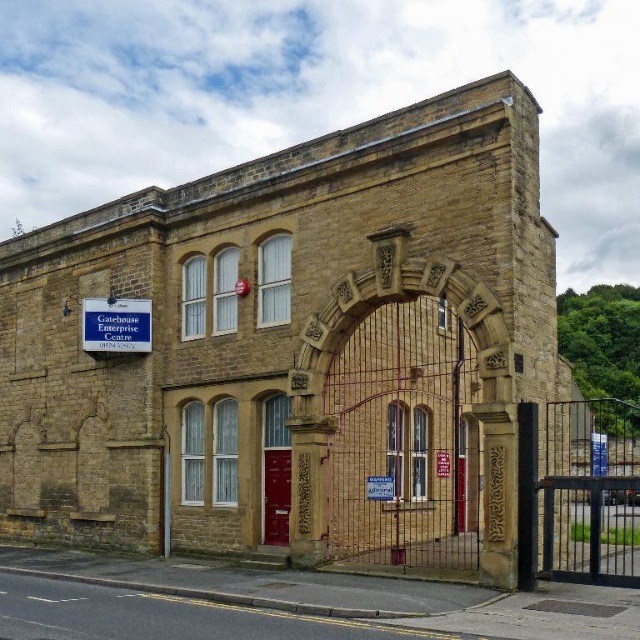
Is white plastic sign at center wider than red plastic sign at center?

Yes, white plastic sign at center is wider than red plastic sign at center.

How much distance is there between white plastic sign at center and red plastic sign at center?

The distance of white plastic sign at center from red plastic sign at center is 6.70 meters.

What are the coordinates of `white plastic sign at center` in the screenshot? It's located at (380, 486).

The width and height of the screenshot is (640, 640). What are the coordinates of `white plastic sign at center` in the screenshot? It's located at (380, 486).

Can you confirm if blue plastic sign at upper left is thinner than red plastic sign at center?

Incorrect, blue plastic sign at upper left's width is not less than red plastic sign at center's.

Between point (124, 298) and point (444, 460), which one is positioned behind?

Point (444, 460)

Is point (97, 332) positioned behind point (442, 456)?

No.

Identify the location of blue plastic sign at upper left. Image resolution: width=640 pixels, height=640 pixels. (x=115, y=324).

Who is taller, blue plastic sign at upper left or white plastic sign at center?

Standing taller between the two is blue plastic sign at upper left.

Which of these two, blue plastic sign at upper left or white plastic sign at center, stands shorter?

With less height is white plastic sign at center.

Between point (84, 333) and point (378, 484), which one is positioned in front?

Point (378, 484)

Identify the location of blue plastic sign at upper left. This screenshot has width=640, height=640. (115, 324).